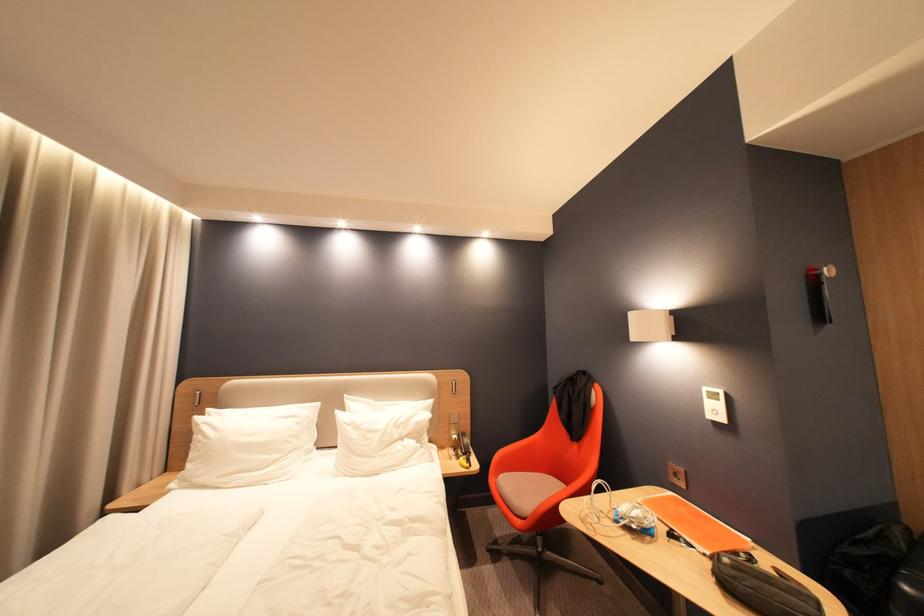
Find where to insert the power outlet. Please return your answer as a coordinate pair (x, y).

(676, 475)